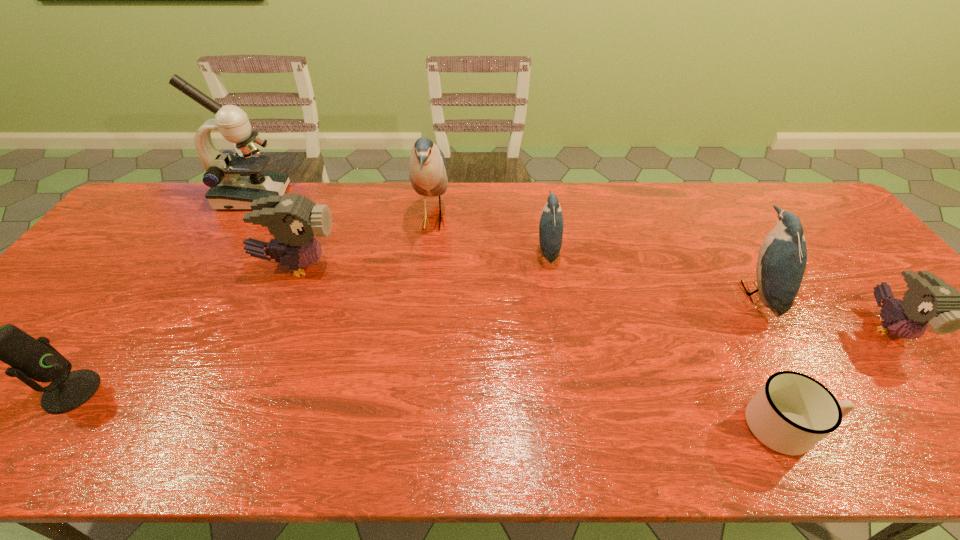
This screenshot has width=960, height=540. What are the coordinates of `vacant region located at the tip of the fourth object from right to left's beak` in the screenshot? It's located at (505, 251).

You are a GUI agent. You are given a task and a screenshot of the screen. Output one action in this format:
    pyautogui.click(x=<x>, y=<y>)
    Task: Click on the vacant space located at the tip of the fourth object from right to left's beak
    This screenshot has width=960, height=540.
    Given the screenshot: What is the action you would take?
    pyautogui.click(x=478, y=251)

Where is `vacant space located at the tip of the fourth object from right to left's beak`? Image resolution: width=960 pixels, height=540 pixels. vacant space located at the tip of the fourth object from right to left's beak is located at coordinates (519, 251).

Locate an element on the screen. Image resolution: width=960 pixels, height=540 pixels. free location located at the beak of the smaller gray bird is located at coordinates (948, 401).

Where is `vacant space located 0.150m on the side of the mug with the handle`? This screenshot has height=540, width=960. vacant space located 0.150m on the side of the mug with the handle is located at coordinates (900, 426).

Locate an element on the screen. microscope at the far edge is located at coordinates (236, 180).

Where is `bird that is at the far edge`? Image resolution: width=960 pixels, height=540 pixels. bird that is at the far edge is located at coordinates (427, 170).

The height and width of the screenshot is (540, 960). What are the coordinates of `object that is at the near edge` in the screenshot? It's located at (792, 412).

You are a GUI agent. You are given a task and a screenshot of the screen. Output one action in this format:
    pyautogui.click(x=<x>, y=<y>)
    Task: Click on the object that is at the left edge
    This screenshot has height=540, width=960.
    Given the screenshot: What is the action you would take?
    pyautogui.click(x=30, y=358)

Where is `object that is at the right edge`? Image resolution: width=960 pixels, height=540 pixels. object that is at the right edge is located at coordinates (929, 299).